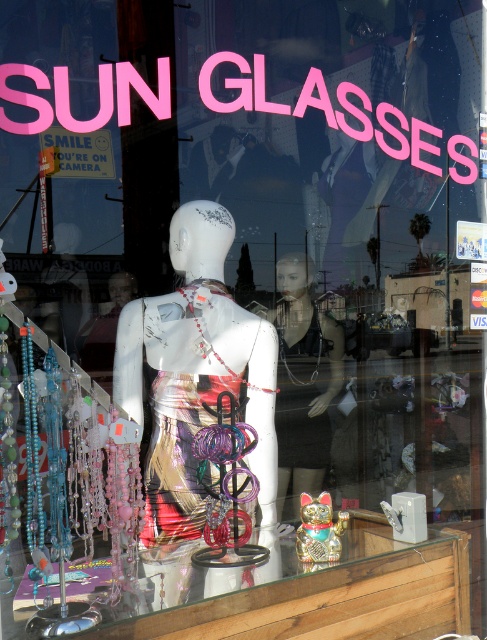
Who is lower down, white glossy mannequin at center or metallic gold cat at center?

metallic gold cat at center

Which is behind, point (265, 388) or point (280, 486)?

Positioned behind is point (280, 486).

This screenshot has width=487, height=640. Find the location of `white glossy mannequin at center`. white glossy mannequin at center is located at coordinates (197, 378).